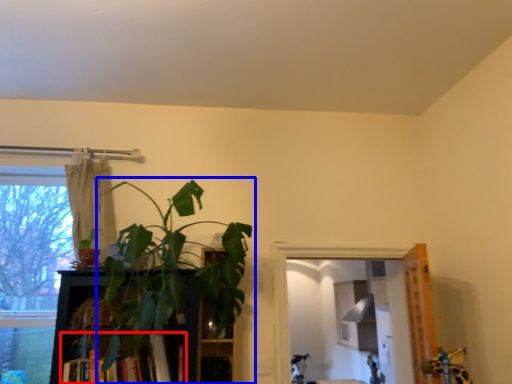
Question: Among these objects, which one is nearest to the camera, book (highlighted by a red box) or houseplant (highlighted by a blue box)?

Choices:
 (A) book
 (B) houseplant

Answer: (B)